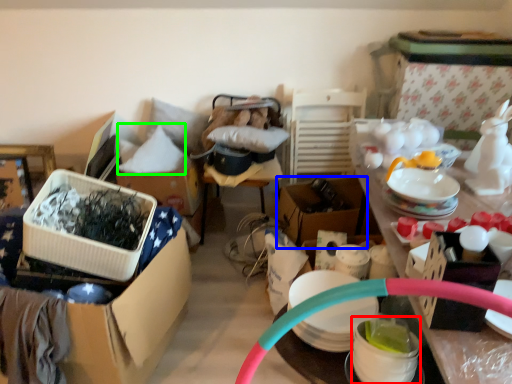
Question: Which object is the farthest from bowl (highlighted by a red box)? Choose among these: box (highlighted by a blue box) or pillow (highlighted by a green box).

Choices:
 (A) box
 (B) pillow

Answer: (B)